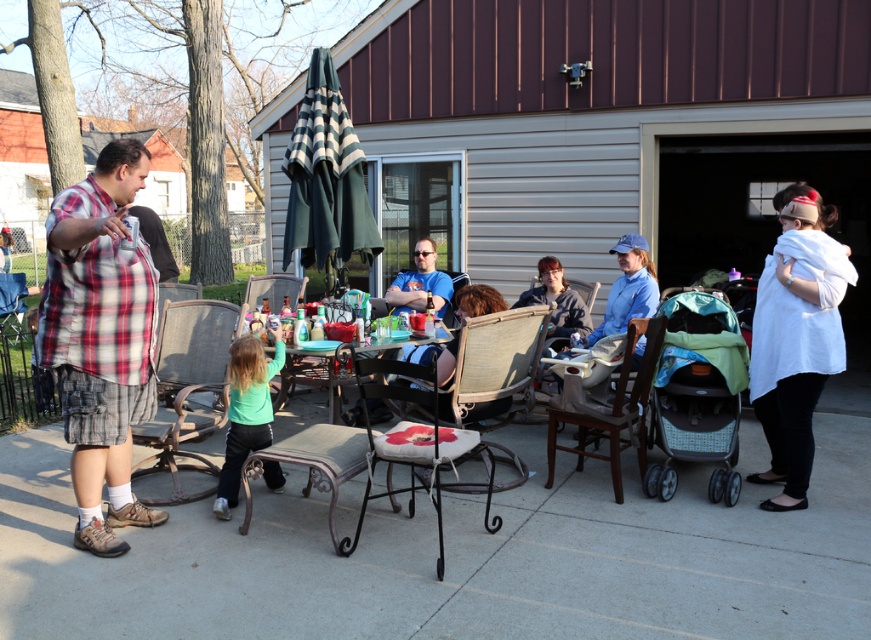
Question: Can you confirm if plaid cotton shirt at left is positioned to the left of white cotton shirt at right?

Choices:
 (A) yes
 (B) no

Answer: (A)

Question: Which point is farther to the camera?

Choices:
 (A) (328, 365)
 (B) (278, 332)

Answer: (A)

Question: Considering the real-world distances, which object is farthest from the metallic silver chair at center?

Choices:
 (A) clear glass table at center
 (B) plaid cotton shirt at left

Answer: (B)

Question: Does light blue fabric stroller at lower right have a lesser width compared to clear glass table at center?

Choices:
 (A) yes
 (B) no

Answer: (A)

Question: Which of the following is the closest to the observer?

Choices:
 (A) (674, 384)
 (B) (188, 323)

Answer: (A)

Question: Does white cotton shirt at right appear on the left side of white fabric cushioned chair at center?

Choices:
 (A) yes
 (B) no

Answer: (B)